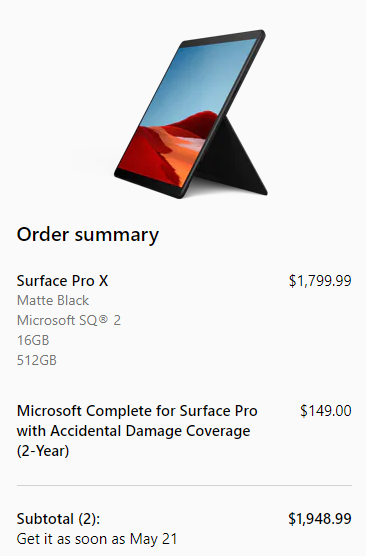
Find the location of a particular element. This screenshot has width=366, height=556. surface is located at coordinates (197, 412).